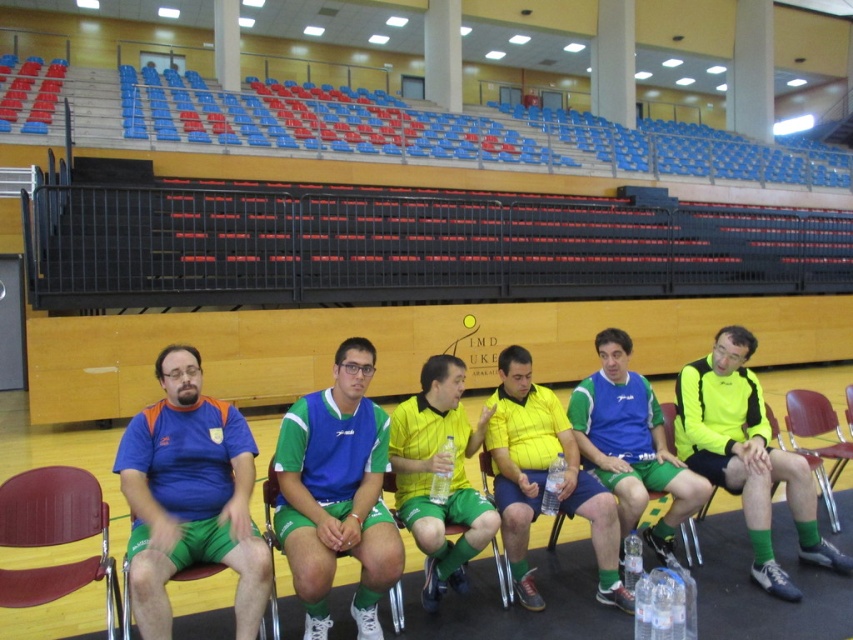
You are a photographer positioned at the front of the arena. You need to capture a photo of the yellow jersey at center and the wooden chair at center. Based on their positions, which object is closer to your left side?

The yellow jersey at center is to the left of wooden chair at center, so the yellow jersey at center is closer to your left side.